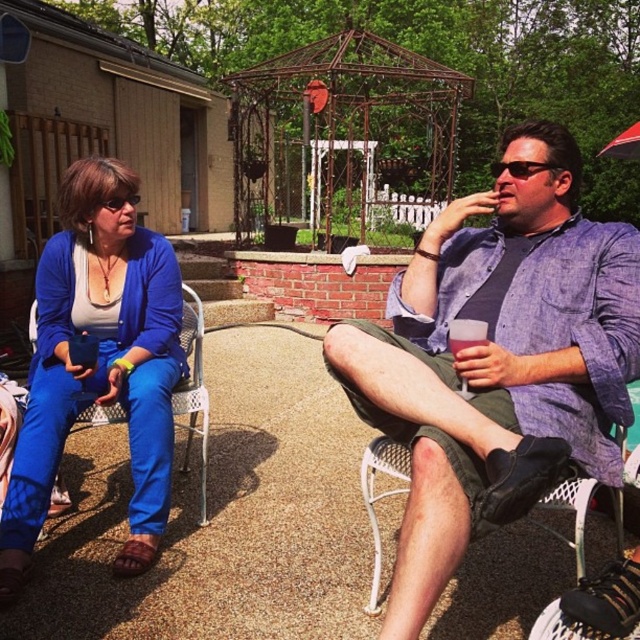
Question: Can you confirm if rusty metal gazebo at center is wider than white mesh chair at lower right?

Choices:
 (A) yes
 (B) no

Answer: (A)

Question: Is matte blue pants at left behind white mesh chair at lower right?

Choices:
 (A) no
 (B) yes

Answer: (B)

Question: Which point is closer to the camera?

Choices:
 (A) (333, 189)
 (B) (148, 538)
 (C) (528, 282)
 (D) (205, 508)

Answer: (C)

Question: Which point is closer to the camera?

Choices:
 (A) white mesh chair at lower right
 (B) matte blue pants at left
 (C) blue fabric chair at left

Answer: (A)

Question: Estimate the real-world distances between objects in this image. Which object is closer to the matte blue pants at left?

Choices:
 (A) blue fabric chair at left
 (B) white mesh chair at lower right
 (C) rusty metal gazebo at center
 (D) denim shirt at center

Answer: (A)

Question: Can you confirm if matte blue pants at left is positioned to the right of blue fabric chair at left?

Choices:
 (A) no
 (B) yes

Answer: (A)